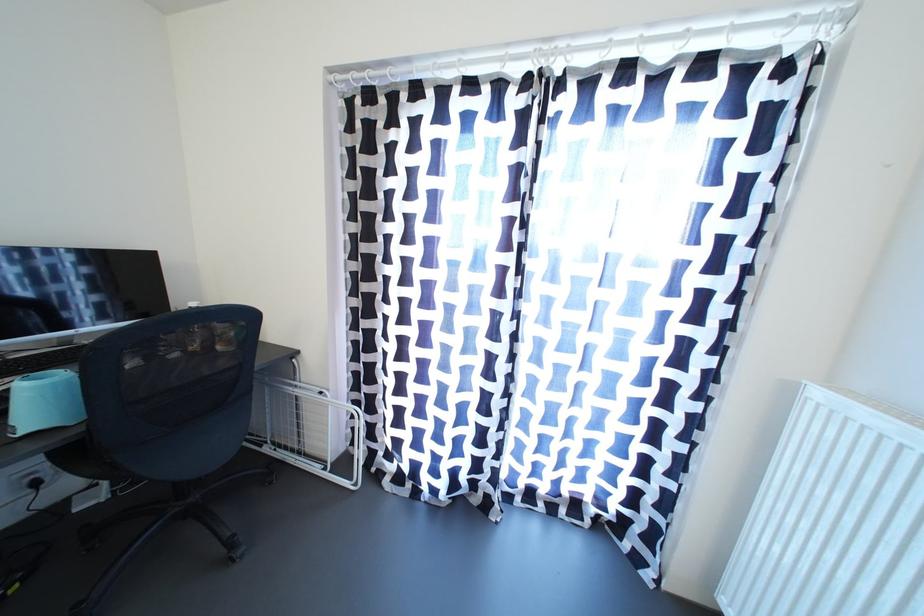
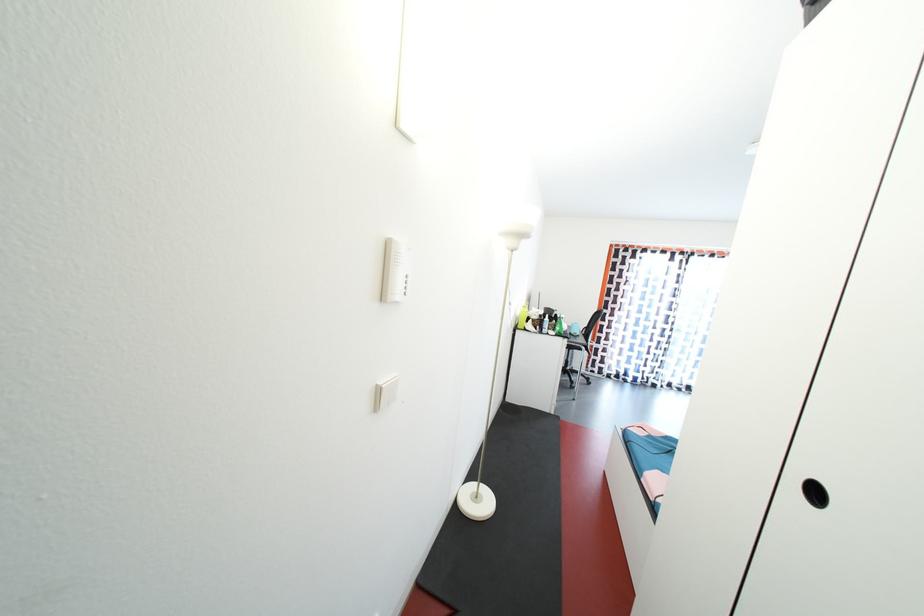
Which direction would the cameraman need to move to produce the second image?

The movement direction of the cameraman is left, backward.